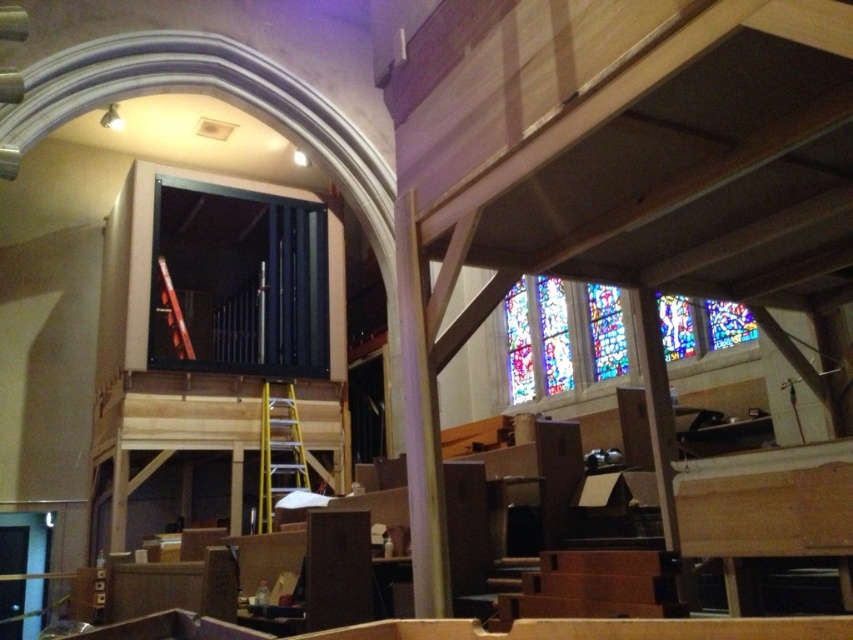
You are an interior designer inspecting the construction site. You need to choose between the yellow metallic ladder at center and the metallic yellow ladder at center to reach the high ceiling beams. Which ladder would you choose and why?

The yellow metallic ladder at center is smaller than the metallic yellow ladder at center, so you should choose the metallic yellow ladder at center because it is taller and can reach the high ceiling beams.

You are a painter who needs to reach a high beam in the church. You have two ladders available here. The yellow metallic ladder at center and the metallic yellow ladder at center. Which ladder is wider and more stable for you to use?

The metallic yellow ladder at center is wider than the yellow metallic ladder at center, so it is more stable for the painter to use.